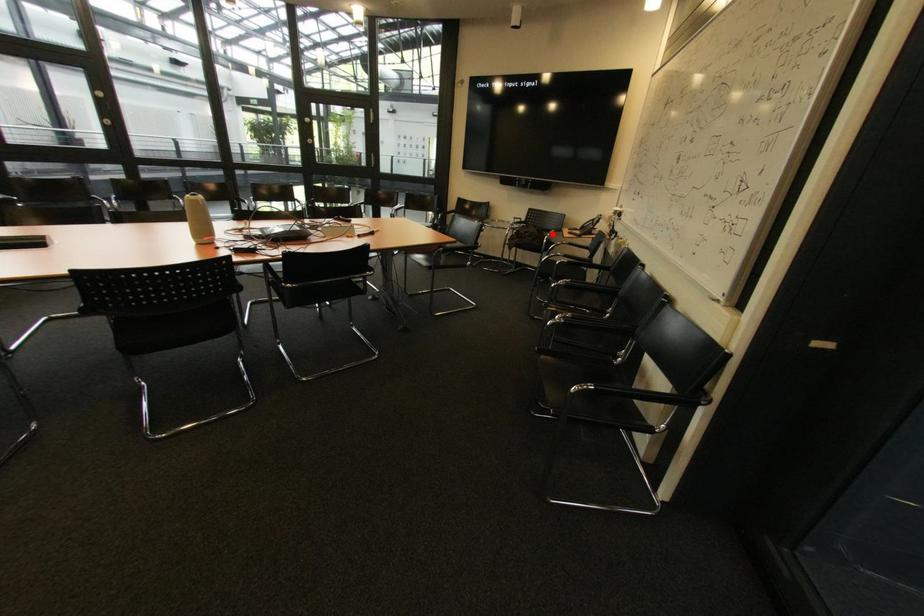
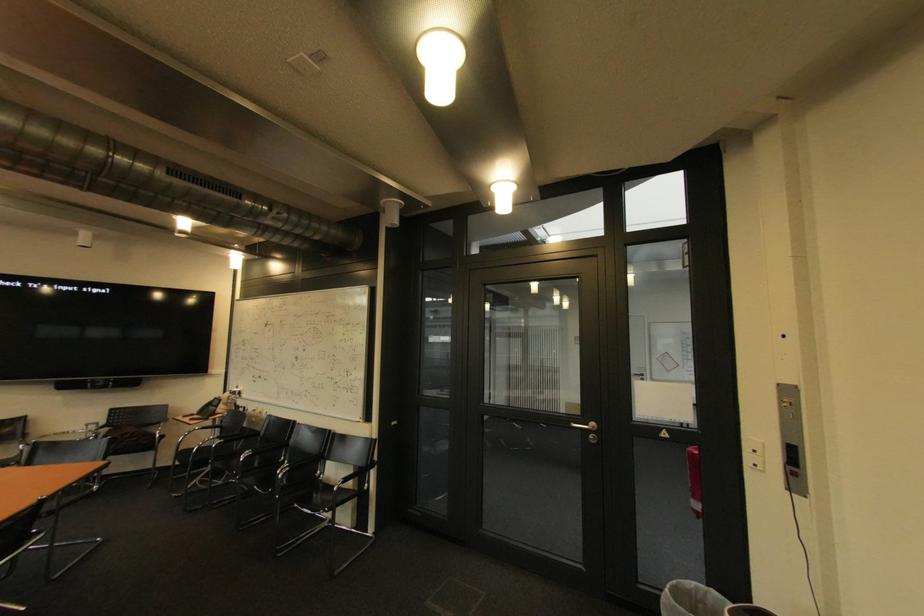
Where in the second image is the point corresponding to the highlighted location from the first image?

(152, 430)